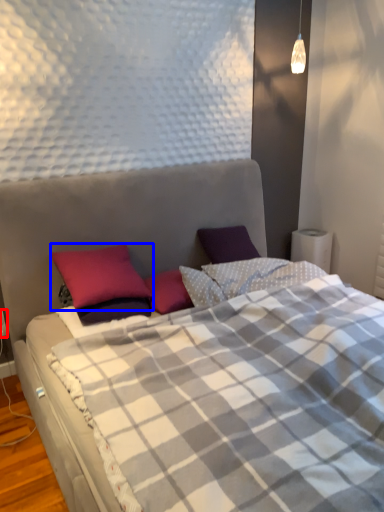
Question: Which object is further to the camera taking this photo, electric outlet (highlighted by a red box) or pillow (highlighted by a blue box)?

Choices:
 (A) electric outlet
 (B) pillow

Answer: (A)